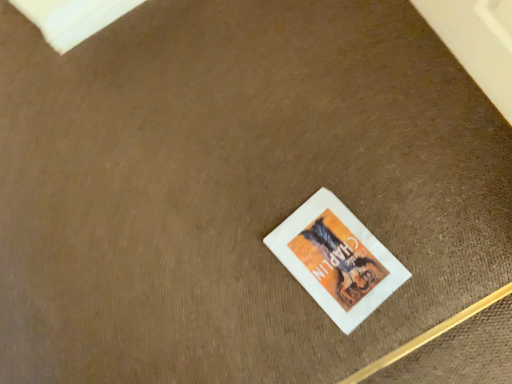
This screenshot has height=384, width=512. What are the coordinates of `vacant area that is situated to the right of white paper book at center` in the screenshot? It's located at (404, 197).